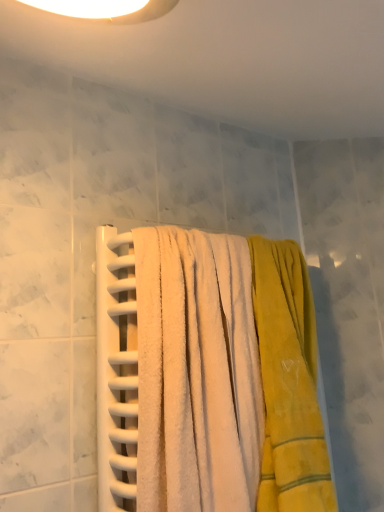
The width and height of the screenshot is (384, 512). Identify the location of yellow soft towel at center, the 1th towel in the right-to-left sequence. (289, 382).

What do you see at coordinates (289, 382) in the screenshot? I see `yellow soft towel at center, which is the second towel in left-to-right order` at bounding box center [289, 382].

The image size is (384, 512). Describe the element at coordinates (196, 373) in the screenshot. I see `white soft towel at center, the first towel viewed from the left` at that location.

Locate an element on the screen. The width and height of the screenshot is (384, 512). white soft towel at center, the first towel viewed from the left is located at coordinates (196, 373).

What is the approximate width of white soft towel at center, the first towel viewed from the left?

The width of white soft towel at center, the first towel viewed from the left, is 23.91 centimeters.

This screenshot has height=512, width=384. I want to click on yellow soft towel at center, which is the second towel in left-to-right order, so click(x=289, y=382).

Does yellow soft towel at center, which is the second towel in left-to-right order, appear on the left side of white soft towel at center, the first towel viewed from the left?

No, yellow soft towel at center, which is the second towel in left-to-right order, is not to the left of white soft towel at center, the first towel viewed from the left.

Relative to white soft towel at center, the first towel viewed from the left, is yellow soft towel at center, which is the second towel in left-to-right order, in front or behind?

yellow soft towel at center, which is the second towel in left-to-right order, is positioned farther from the viewer than white soft towel at center, the first towel viewed from the left.

Does point (282, 252) come behind point (221, 239)?

Yes, it is behind point (221, 239).

From the image's perspective, which one is positioned higher, yellow soft towel at center, which is the second towel in left-to-right order, or white soft towel at center, the first towel viewed from the left?

white soft towel at center, the first towel viewed from the left, is shown above in the image.

From a real-world perspective, is yellow soft towel at center, which is the second towel in left-to-right order, positioned above or below white soft towel at center, the 2th towel when ordered from right to left?

In terms of real-world spatial position, yellow soft towel at center, which is the second towel in left-to-right order, is below white soft towel at center, the 2th towel when ordered from right to left.

Which of these two, yellow soft towel at center, the 1th towel in the right-to-left sequence, or white soft towel at center, the first towel viewed from the left, is wider?

white soft towel at center, the first towel viewed from the left, is wider.

Is yellow soft towel at center, the 1th towel in the right-to-left sequence, shorter than white soft towel at center, the 2th towel when ordered from right to left?

No, yellow soft towel at center, the 1th towel in the right-to-left sequence, is not shorter than white soft towel at center, the 2th towel when ordered from right to left.

Does yellow soft towel at center, which is the second towel in left-to-right order, have a larger size compared to white soft towel at center, the first towel viewed from the left?

Actually, yellow soft towel at center, which is the second towel in left-to-right order, might be smaller than white soft towel at center, the first towel viewed from the left.

Could white soft towel at center, the first towel viewed from the left, be considered to be inside yellow soft towel at center, which is the second towel in left-to-right order?

No, yellow soft towel at center, which is the second towel in left-to-right order, does not contain white soft towel at center, the first towel viewed from the left.

Is yellow soft towel at center, which is the second towel in left-to-right order, positioned far away from white soft towel at center, the 2th towel when ordered from right to left?

No.

Is yellow soft towel at center, the 1th towel in the right-to-left sequence, looking in the opposite direction of white soft towel at center, the 2th towel when ordered from right to left?

yellow soft towel at center, the 1th towel in the right-to-left sequence, does not have its back to white soft towel at center, the 2th towel when ordered from right to left.

What's the angular difference between yellow soft towel at center, which is the second towel in left-to-right order, and white soft towel at center, the 2th towel when ordered from right to left,'s facing directions?

0.00198 degrees.

Find the location of a particular element. towel below the white soft towel at center, the first towel viewed from the left (from a real-world perspective) is located at coordinates (289, 382).

Which object is positioned more to the left, white soft towel at center, the 2th towel when ordered from right to left, or yellow soft towel at center, which is the second towel in left-to-right order?

Positioned to the left is white soft towel at center, the 2th towel when ordered from right to left.

Considering the positions of objects white soft towel at center, the 2th towel when ordered from right to left, and yellow soft towel at center, the 1th towel in the right-to-left sequence, in the image provided, who is behind, white soft towel at center, the 2th towel when ordered from right to left, or yellow soft towel at center, the 1th towel in the right-to-left sequence,?

Positioned behind is yellow soft towel at center, the 1th towel in the right-to-left sequence.

Does point (153, 452) come in front of point (254, 283)?

Yes.

From the image's perspective, would you say white soft towel at center, the 2th towel when ordered from right to left, is positioned over yellow soft towel at center, which is the second towel in left-to-right order?

Yes, from the image's perspective, white soft towel at center, the 2th towel when ordered from right to left, is on top of yellow soft towel at center, which is the second towel in left-to-right order.

In the scene shown: From a real-world perspective, is white soft towel at center, the first towel viewed from the left, physically below yellow soft towel at center, the 1th towel in the right-to-left sequence?

No, from a real-world perspective, white soft towel at center, the first towel viewed from the left, is not beneath yellow soft towel at center, the 1th towel in the right-to-left sequence.

Considering the relative sizes of white soft towel at center, the 2th towel when ordered from right to left, and yellow soft towel at center, which is the second towel in left-to-right order, in the image provided, is white soft towel at center, the 2th towel when ordered from right to left, thinner than yellow soft towel at center, which is the second towel in left-to-right order,?

No, white soft towel at center, the 2th towel when ordered from right to left, is not thinner than yellow soft towel at center, which is the second towel in left-to-right order.

Can you confirm if white soft towel at center, the 2th towel when ordered from right to left, is shorter than yellow soft towel at center, the 1th towel in the right-to-left sequence?

Correct, white soft towel at center, the 2th towel when ordered from right to left, is not as tall as yellow soft towel at center, the 1th towel in the right-to-left sequence.

Considering the sizes of objects white soft towel at center, the 2th towel when ordered from right to left, and yellow soft towel at center, the 1th towel in the right-to-left sequence, in the image provided, who is smaller, white soft towel at center, the 2th towel when ordered from right to left, or yellow soft towel at center, the 1th towel in the right-to-left sequence,?

yellow soft towel at center, the 1th towel in the right-to-left sequence.

Would you say white soft towel at center, the 2th towel when ordered from right to left, is inside or outside yellow soft towel at center, which is the second towel in left-to-right order?

white soft towel at center, the 2th towel when ordered from right to left, cannot be found inside yellow soft towel at center, which is the second towel in left-to-right order.

Can you see white soft towel at center, the first towel viewed from the left, touching yellow soft towel at center, which is the second towel in left-to-right order?

white soft towel at center, the first towel viewed from the left, is not next to yellow soft towel at center, which is the second towel in left-to-right order, and they're not touching.

Could you tell me if white soft towel at center, the first towel viewed from the left, is facing yellow soft towel at center, the 1th towel in the right-to-left sequence?

No, white soft towel at center, the first towel viewed from the left, is not facing towards yellow soft towel at center, the 1th towel in the right-to-left sequence.

Can you tell me how much white soft towel at center, the first towel viewed from the left, and yellow soft towel at center, which is the second towel in left-to-right order, differ in facing direction?

0.00198 degrees separate the facing orientations of white soft towel at center, the first towel viewed from the left, and yellow soft towel at center, which is the second towel in left-to-right order.

The height and width of the screenshot is (512, 384). I want to click on towel that is behind the white soft towel at center, the first towel viewed from the left, so click(x=289, y=382).

You are a GUI agent. You are given a task and a screenshot of the screen. Output one action in this format:
    pyautogui.click(x=<x>, y=<y>)
    Task: Click on the towel on the right side of white soft towel at center, the first towel viewed from the left
    
    Given the screenshot: What is the action you would take?
    pyautogui.click(x=289, y=382)

This screenshot has height=512, width=384. I want to click on towel below the white soft towel at center, the first towel viewed from the left (from a real-world perspective), so click(289, 382).